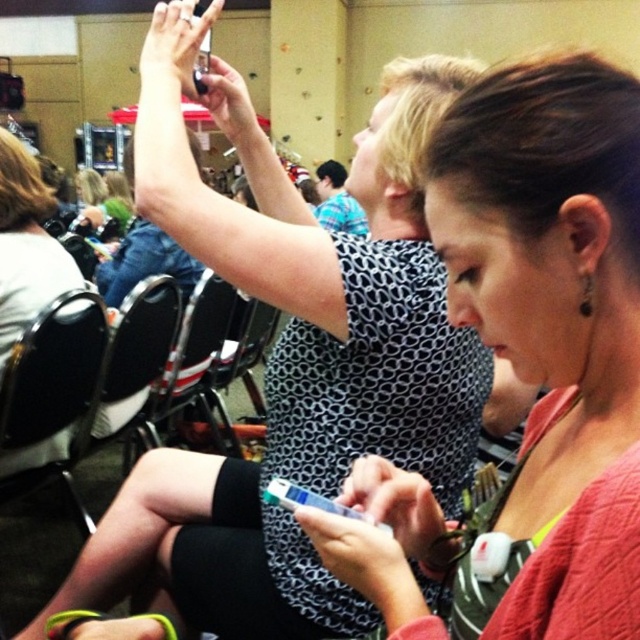
You are organizing a photoshoot and need to ensure that the pink textured sweater at center is visible in the final image. Given that the black fabric chair at center is currently blocking part of the sweater, how should you adjust the setup?

The pink textured sweater at center is positioned over the black fabric chair at center. To ensure visibility, move the black fabric chair at center slightly so the sweater is no longer covered or reposition the sweater to hang freely without overlapping the chair.

You are a photographer trying to capture the pink textured sweater at center in your shot. Your camera has a minimum focus distance of 35 centimeters. Can you focus on the sweater from your current position?

The pink textured sweater at center is 36.36 centimeters from the viewer, which is beyond the camera minimum focus distance of 35 centimeters. Therefore, the camera can focus on the sweater from the current position.